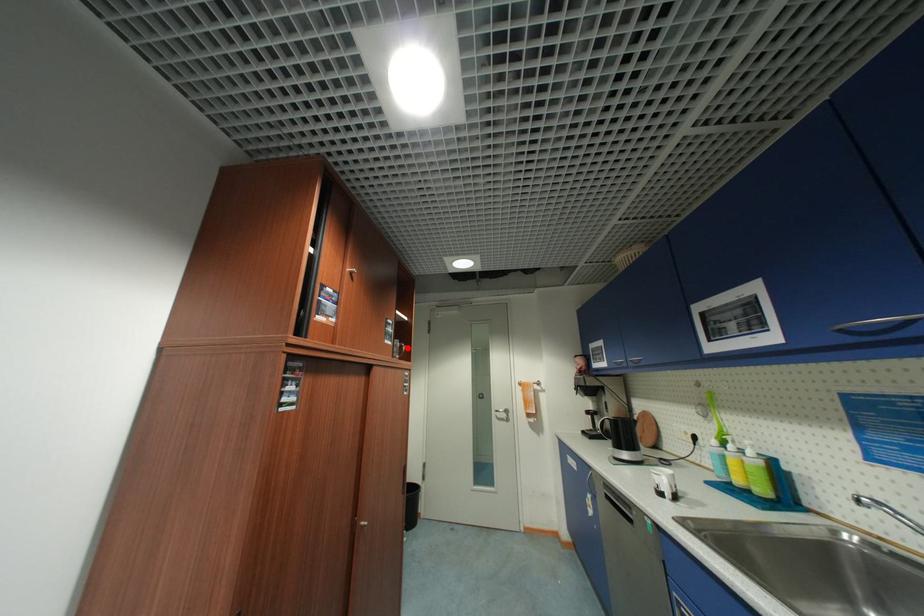
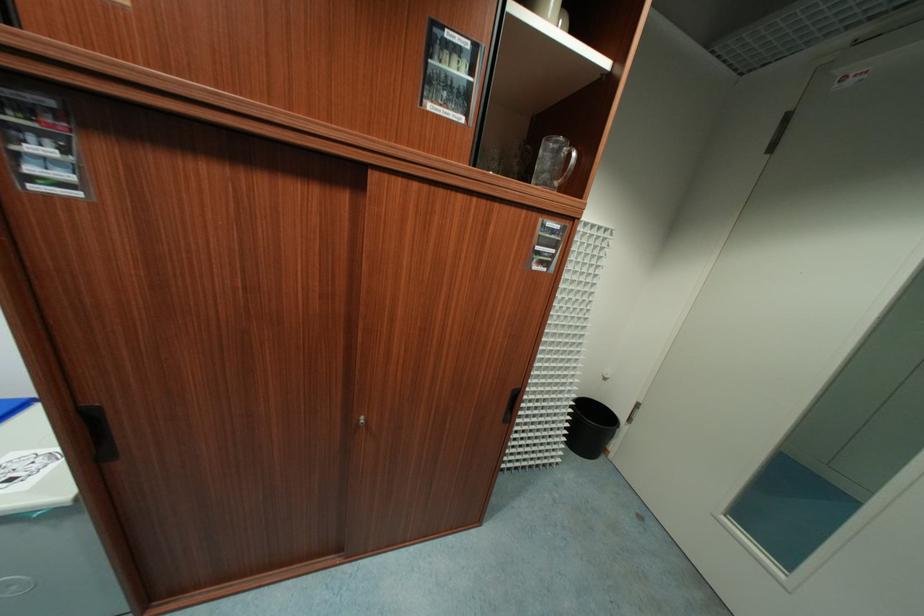
Question: A red point is marked in image1. In image2, is the corresponding 3D point closer to the camera or farther? Reply with the corresponding letter.

Choices:
 (A) The corresponding 3D point is closer.
 (B) The corresponding 3D point is farther.

Answer: (A)